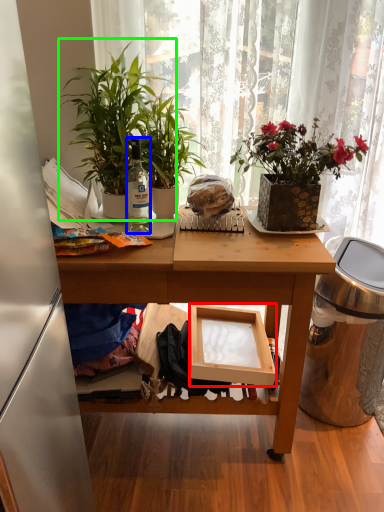
Question: Which object is positioned farthest from box (highlighted by a red box)? Select from bottle (highlighted by a blue box) and houseplant (highlighted by a green box).

Choices:
 (A) bottle
 (B) houseplant

Answer: (B)